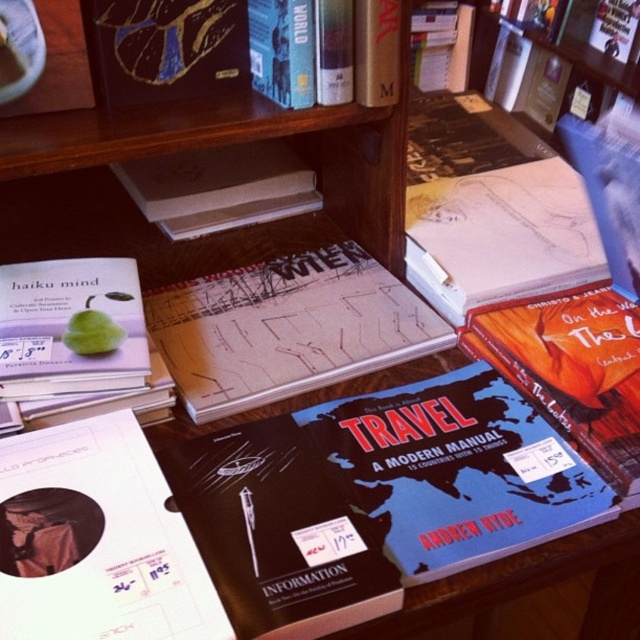
You are a customer in the bookstore and want to place a 30 cm wide gift box between the white matte book at lower left and the white matte book at center. Can you fit it there?

The distance between the white matte book at lower left and the white matte book at center is 53.06 centimeters. Since the gift box is 30 cm wide, it can fit in the space between them as the available space is larger than the box.

You are a customer in the bookstore and want to buy both the white matte book at lower left and the white matte book at center. If you have a bag that can only hold one book, which one should you choose based on their sizes?

The white matte book at lower left is smaller than the white matte book at center, so you should choose the white matte book at lower left to fit in your bag.

You are standing in the bookstore and see the point marked at coordinates (456, 470). Which book is this point located on?

The point marked at coordinates (456, 470) is located on the blue matte travel guide at center.